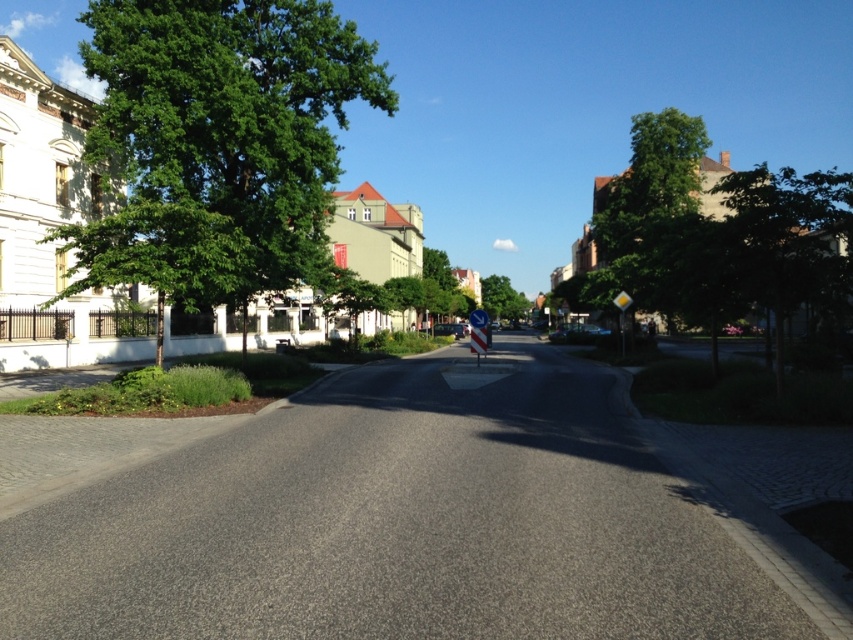
Question: Considering the relative positions of green leafy tree at left and green leafy tree at center in the image provided, where is green leafy tree at left located with respect to green leafy tree at center?

Choices:
 (A) left
 (B) right

Answer: (A)

Question: Which point is closer to the camera taking this photo?

Choices:
 (A) (492, 292)
 (B) (189, 227)

Answer: (B)

Question: Considering the relative positions of green leafy tree at left and green leafy tree at center in the image provided, where is green leafy tree at left located with respect to green leafy tree at center?

Choices:
 (A) right
 (B) left

Answer: (B)

Question: Observing the image, what is the correct spatial positioning of green leafy tree at left in reference to green leafy tree at center?

Choices:
 (A) right
 (B) left

Answer: (B)